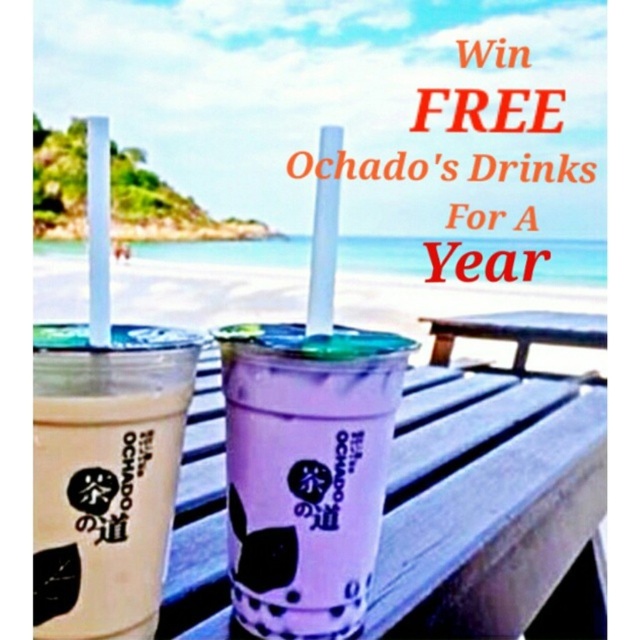
Question: Does matte beige cup at left appear under wooden picnic table at center?

Choices:
 (A) no
 (B) yes

Answer: (B)

Question: Estimate the real-world distances between objects in this image. Which object is closer to the purple translucent cup at center?

Choices:
 (A) matte beige cup at left
 (B) wooden picnic table at center

Answer: (A)

Question: Is purple translucent cup at center closer to camera compared to wooden picnic table at center?

Choices:
 (A) no
 (B) yes

Answer: (B)

Question: Which point is farther from the camera taking this photo?

Choices:
 (A) (579, 330)
 (B) (195, 346)

Answer: (A)

Question: Which point is farther from the camera taking this photo?

Choices:
 (A) (304, 396)
 (B) (534, 314)
 (C) (51, 467)

Answer: (B)

Question: Is purple translucent cup at center further to the viewer compared to matte beige cup at left?

Choices:
 (A) no
 (B) yes

Answer: (B)